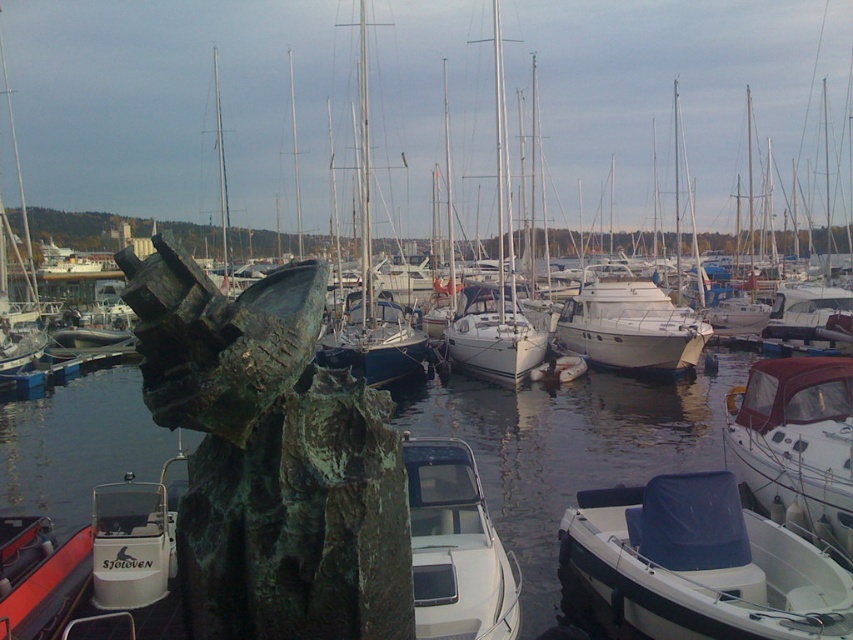
You are standing at the edge of the marina and see the green patina statue at center and the white glossy boat at center. Which object is positioned more to the left from your viewpoint?

The green patina statue at center is positioned to the left of the white glossy boat at center, so the green patina statue at center is more to the left.

You are standing at the pier and see both the white plastic boat at lower right and the white glossy boat at lower right. Which boat is positioned lower in the scene?

The white plastic boat at lower right is positioned lower than the white glossy boat at lower right.